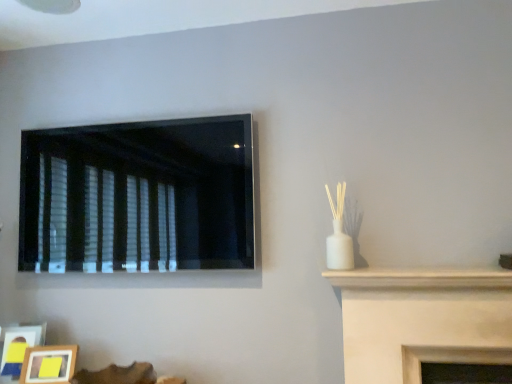
Question: From the image's perspective, is wooden photo frame at lower left, acting as the 1th picture frame starting from the right, above wooden picture frame at lower left, which ranks as the 2th picture frame in right-to-left order?

Choices:
 (A) yes
 (B) no

Answer: (B)

Question: From a real-world perspective, is wooden photo frame at lower left, acting as the 1th picture frame starting from the right, over wooden picture frame at lower left, the 1th picture frame in the left-to-right sequence?

Choices:
 (A) no
 (B) yes

Answer: (A)

Question: Considering the relative sizes of wooden photo frame at lower left, the second picture frame when ordered from left to right, and wooden picture frame at lower left, the 1th picture frame in the left-to-right sequence, in the image provided, is wooden photo frame at lower left, the second picture frame when ordered from left to right, bigger than wooden picture frame at lower left, the 1th picture frame in the left-to-right sequence,?

Choices:
 (A) yes
 (B) no

Answer: (B)

Question: Could you tell me if wooden photo frame at lower left, acting as the 1th picture frame starting from the right, is facing wooden picture frame at lower left, which ranks as the 2th picture frame in right-to-left order?

Choices:
 (A) yes
 (B) no

Answer: (B)

Question: Considering the relative sizes of wooden photo frame at lower left, the second picture frame when ordered from left to right, and wooden picture frame at lower left, the 1th picture frame in the left-to-right sequence, in the image provided, is wooden photo frame at lower left, the second picture frame when ordered from left to right, smaller than wooden picture frame at lower left, the 1th picture frame in the left-to-right sequence,?

Choices:
 (A) no
 (B) yes

Answer: (B)

Question: From the image's perspective, is wooden photo frame at lower left, acting as the 1th picture frame starting from the right, positioned above or below black matte window at upper left?

Choices:
 (A) below
 (B) above

Answer: (A)

Question: Does point (73, 350) appear closer or farther from the camera than point (64, 134)?

Choices:
 (A) farther
 (B) closer

Answer: (B)

Question: Is wooden photo frame at lower left, the second picture frame when ordered from left to right, inside the boundaries of black matte window at upper left, or outside?

Choices:
 (A) outside
 (B) inside

Answer: (A)

Question: Considering the positions of wooden photo frame at lower left, the second picture frame when ordered from left to right, and black matte window at upper left in the image, is wooden photo frame at lower left, the second picture frame when ordered from left to right, wider or thinner than black matte window at upper left?

Choices:
 (A) thin
 (B) wide

Answer: (B)

Question: From the image's perspective, is wooden picture frame at lower left, which ranks as the 2th picture frame in right-to-left order, positioned above or below black matte window at upper left?

Choices:
 (A) below
 (B) above

Answer: (A)

Question: From their relative heights in the image, would you say wooden picture frame at lower left, which ranks as the 2th picture frame in right-to-left order, is taller or shorter than black matte window at upper left?

Choices:
 (A) tall
 (B) short

Answer: (B)

Question: Considering the positions of wooden picture frame at lower left, the 1th picture frame in the left-to-right sequence, and black matte window at upper left in the image, is wooden picture frame at lower left, the 1th picture frame in the left-to-right sequence, wider or thinner than black matte window at upper left?

Choices:
 (A) wide
 (B) thin

Answer: (A)

Question: Relative to black matte window at upper left, is wooden picture frame at lower left, which ranks as the 2th picture frame in right-to-left order, in front or behind?

Choices:
 (A) behind
 (B) front

Answer: (A)

Question: Is black matte window at upper left to the left or to the right of wooden photo frame at lower left, the second picture frame when ordered from left to right, in the image?

Choices:
 (A) left
 (B) right

Answer: (B)

Question: Relative to wooden photo frame at lower left, the second picture frame when ordered from left to right, is black matte window at upper left in front or behind?

Choices:
 (A) front
 (B) behind

Answer: (A)